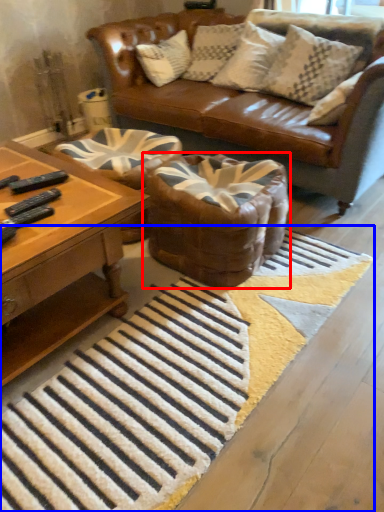
Question: Which of the following is the farthest to the observer, swivel chair (highlighted by a red box) or doormat (highlighted by a blue box)?

Choices:
 (A) swivel chair
 (B) doormat

Answer: (A)